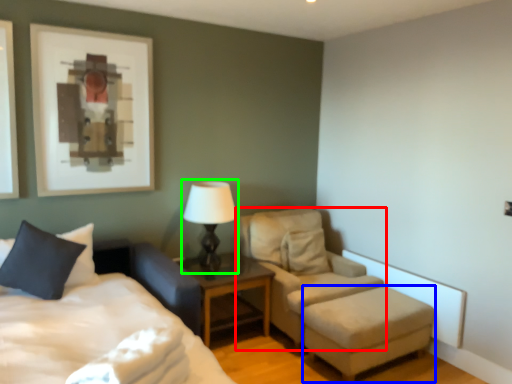
Question: Which object is the farthest from chair (highlighted by a red box)? Choose among these: stool (highlighted by a blue box) or table lamp (highlighted by a green box).

Choices:
 (A) stool
 (B) table lamp

Answer: (B)